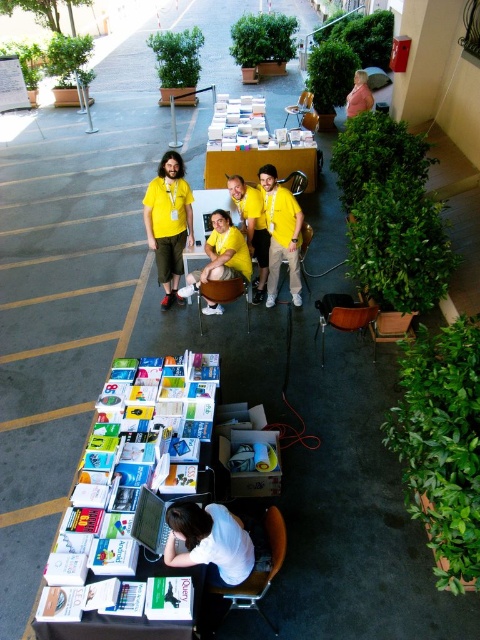
You are organizing a book distribution event and need to place a large banner on the surface that can accommodate it. Which object from the scene, the white paper table at lower left or the matte yellow shirt at center, would be more suitable for placing the banner?

The white paper table at lower left is bigger than the matte yellow shirt at center, so the white paper table at lower left would be more suitable for placing the large banner.

You are standing in the outdoor book distribution event area. You need to place a large box that is 3 meters long on the ground. The white paper table at lower left is in your way. Can you move the box past the table without tilting it?

The white paper table at lower left is 2.48 meters from the viewer. Since the box is 3 meters long, it cannot fit past the table without tilting because the distance available is shorter than the box length.